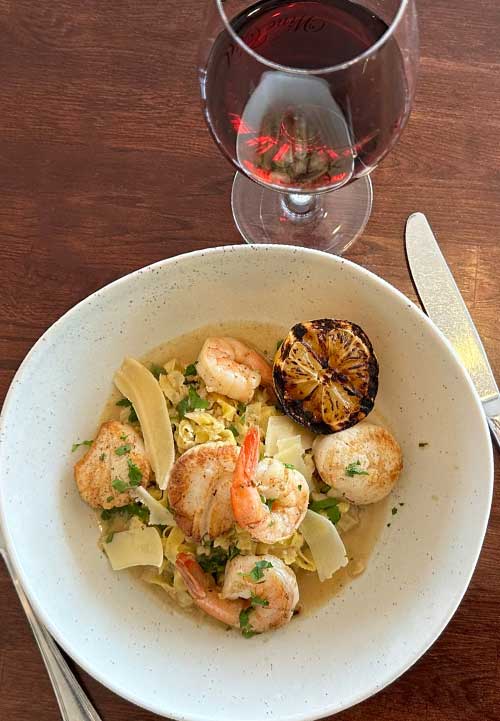
I want to click on white bowl, so click(x=372, y=654).